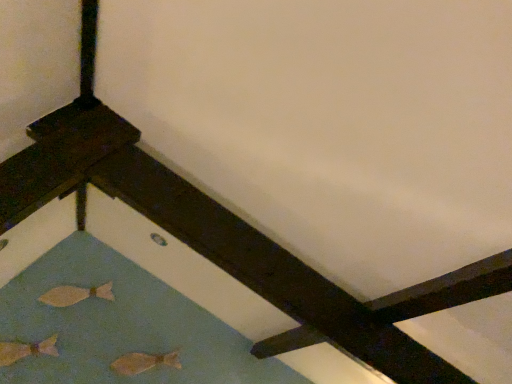
Question: Is matte beige fish at lower left, which is the third fish in left-to-right order, next to matte gold fish at lower left, the second fish from the top, and touching it?

Choices:
 (A) yes
 (B) no

Answer: (B)

Question: Can you confirm if matte beige fish at lower left, positioned as the first fish in bottom-to-top order, is taller than matte gold fish at lower left, acting as the 2th fish starting from the bottom?

Choices:
 (A) yes
 (B) no

Answer: (B)

Question: Is matte beige fish at lower left, which is the 3th fish from top to bottom, positioned with its back to matte gold fish at lower left, the second fish from the top?

Choices:
 (A) no
 (B) yes

Answer: (A)

Question: From the image's perspective, would you say matte beige fish at lower left, which is the 3th fish from top to bottom, is positioned over matte gold fish at lower left, which ranks as the 1th fish in left-to-right order?

Choices:
 (A) yes
 (B) no

Answer: (B)

Question: From the image's perspective, is matte beige fish at lower left, which is the 3th fish from top to bottom, below matte gold fish at lower left, which ranks as the 1th fish in left-to-right order?

Choices:
 (A) yes
 (B) no

Answer: (A)

Question: Is matte beige fish at lower left, which is the third fish in left-to-right order, to the left or to the right of matte beige fish at lower left, which is the first fish from top to bottom, in the image?

Choices:
 (A) left
 (B) right

Answer: (B)

Question: Does point (113, 367) appear closer or farther from the camera than point (46, 296)?

Choices:
 (A) farther
 (B) closer

Answer: (B)

Question: From the image's perspective, relative to matte beige fish at lower left, which is the first fish from top to bottom, is matte beige fish at lower left, positioned as the first fish in bottom-to-top order, above or below?

Choices:
 (A) above
 (B) below

Answer: (B)

Question: Do you think matte beige fish at lower left, which is the 3th fish from top to bottom, is within matte beige fish at lower left, the 2th fish viewed from the right, or outside of it?

Choices:
 (A) outside
 (B) inside

Answer: (A)

Question: Is matte beige fish at lower left, positioned as the first fish in bottom-to-top order, bigger or smaller than matte gold fish at lower left, acting as the 2th fish starting from the bottom?

Choices:
 (A) big
 (B) small

Answer: (B)

Question: Is point (125, 362) closer or farther from the camera than point (19, 342)?

Choices:
 (A) closer
 (B) farther

Answer: (B)

Question: In the image, is matte beige fish at lower left, positioned as the first fish in bottom-to-top order, on the left side or the right side of matte gold fish at lower left, which ranks as the 1th fish in left-to-right order?

Choices:
 (A) right
 (B) left

Answer: (A)

Question: From a real-world perspective, is matte beige fish at lower left, the 1th fish viewed from the right, positioned above or below matte gold fish at lower left, acting as the 2th fish starting from the bottom?

Choices:
 (A) below
 (B) above

Answer: (A)

Question: Considering the positions of matte beige fish at lower left, the 2th fish viewed from the right, and matte gold fish at lower left, positioned as the 3th fish in right-to-left order, in the image, is matte beige fish at lower left, the 2th fish viewed from the right, wider or thinner than matte gold fish at lower left, positioned as the 3th fish in right-to-left order,?

Choices:
 (A) thin
 (B) wide

Answer: (A)

Question: From the image's perspective, is matte beige fish at lower left, acting as the third fish starting from the bottom, above or below matte gold fish at lower left, acting as the 2th fish starting from the bottom?

Choices:
 (A) above
 (B) below

Answer: (A)